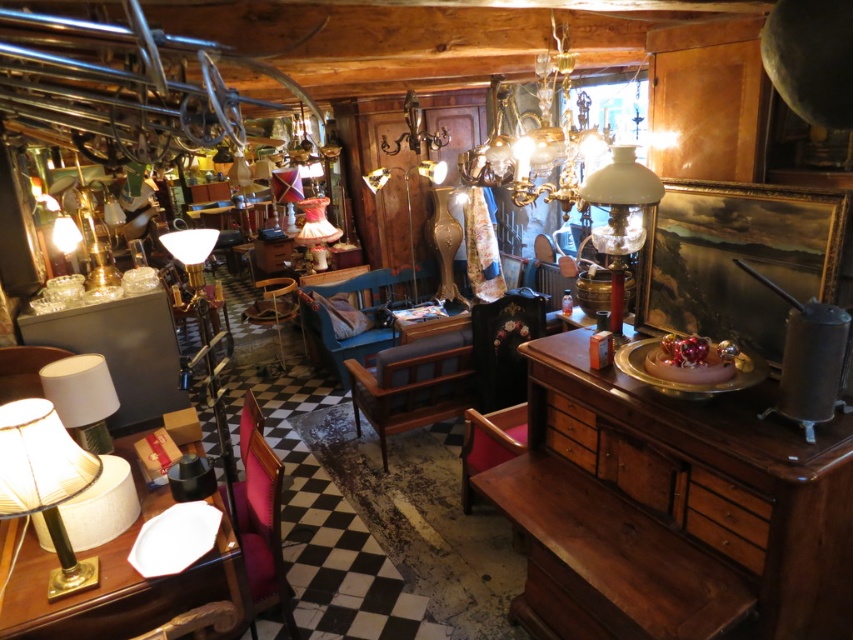
Between dark blue fabric chair at center and velvet pink chair at lower left, which one appears on the right side from the viewer's perspective?

Positioned to the right is dark blue fabric chair at center.

Who is shorter, dark blue fabric chair at center or velvet pink chair at lower left?

With less height is velvet pink chair at lower left.

Which is behind, point (425, 387) or point (30, 360)?

The point (425, 387) is behind.

The image size is (853, 640). Identify the location of dark blue fabric chair at center. (450, 369).

Can you confirm if pink velvet chair at center is smaller than velvet pink chair at lower left?

Actually, pink velvet chair at center might be larger than velvet pink chair at lower left.

Measure the distance between point (x=254, y=481) and camera.

Point (x=254, y=481) and camera are 2.79 meters apart from each other.

Locate an element on the screen. Image resolution: width=853 pixels, height=640 pixels. pink velvet chair at center is located at coordinates (262, 529).

You are a GUI agent. You are given a task and a screenshot of the screen. Output one action in this format:
    pyautogui.click(x=<x>, y=<y>)
    Task: Click on the pink velvet chair at center
    The image size is (853, 640).
    Given the screenshot: What is the action you would take?
    pyautogui.click(x=262, y=529)

Based on the photo, can you confirm if gold metallic lampshade at lower left is taller than white glass lamp at right?

No, gold metallic lampshade at lower left is not taller than white glass lamp at right.

Based on the photo, is gold metallic lampshade at lower left wider than white glass lamp at right?

Indeed, gold metallic lampshade at lower left has a greater width compared to white glass lamp at right.

Does point (28, 410) lie in front of point (585, 193)?

Yes, point (28, 410) is in front of point (585, 193).

Locate an element on the screen. gold metallic lampshade at lower left is located at coordinates (45, 483).